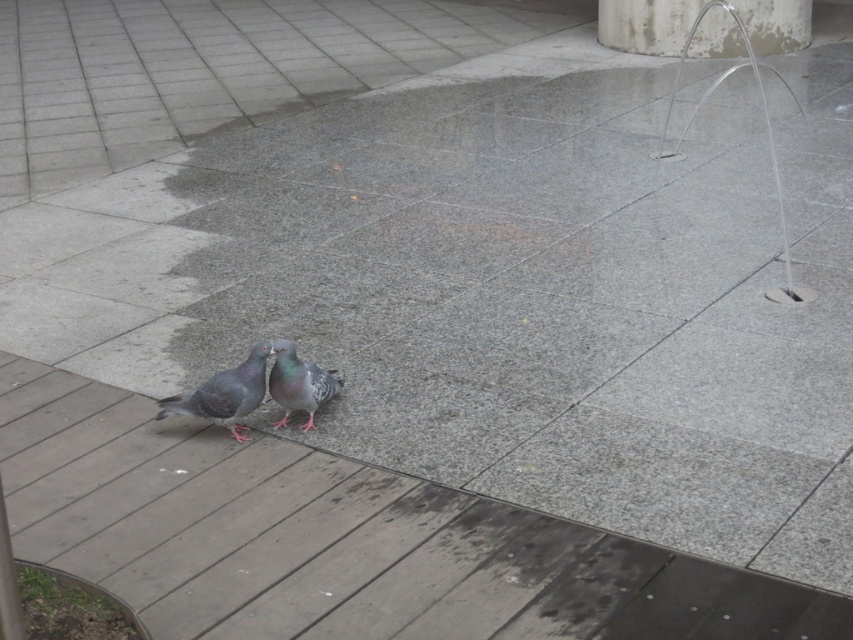
Which is above, white concrete pillar at upper right or gray matte pigeon at lower left?

Positioned higher is white concrete pillar at upper right.

Who is more distant from viewer, (614, 20) or (169, 403)?

Point (614, 20)

Find the location of a particular element. The height and width of the screenshot is (640, 853). white concrete pillar at upper right is located at coordinates (646, 24).

Does white concrete pillar at upper right appear on the left side of gray matte pigeon at center?

Incorrect, white concrete pillar at upper right is not on the left side of gray matte pigeon at center.

The width and height of the screenshot is (853, 640). Identify the location of white concrete pillar at upper right. (646, 24).

Where is `white concrete pillar at upper right`? The image size is (853, 640). white concrete pillar at upper right is located at coordinates (646, 24).

Who is shorter, gray matte pigeon at lower left or gray matte pigeon at center?

gray matte pigeon at center is shorter.

Is gray matte pigeon at lower left bigger than gray matte pigeon at center?

Actually, gray matte pigeon at lower left might be smaller than gray matte pigeon at center.

Between point (263, 349) and point (312, 417), which one is positioned behind?

Point (312, 417)

You are a GUI agent. You are given a task and a screenshot of the screen. Output one action in this format:
    pyautogui.click(x=<x>, y=<y>)
    Task: Click on the gray matte pigeon at lower left
    The height and width of the screenshot is (640, 853).
    Given the screenshot: What is the action you would take?
    pyautogui.click(x=224, y=394)